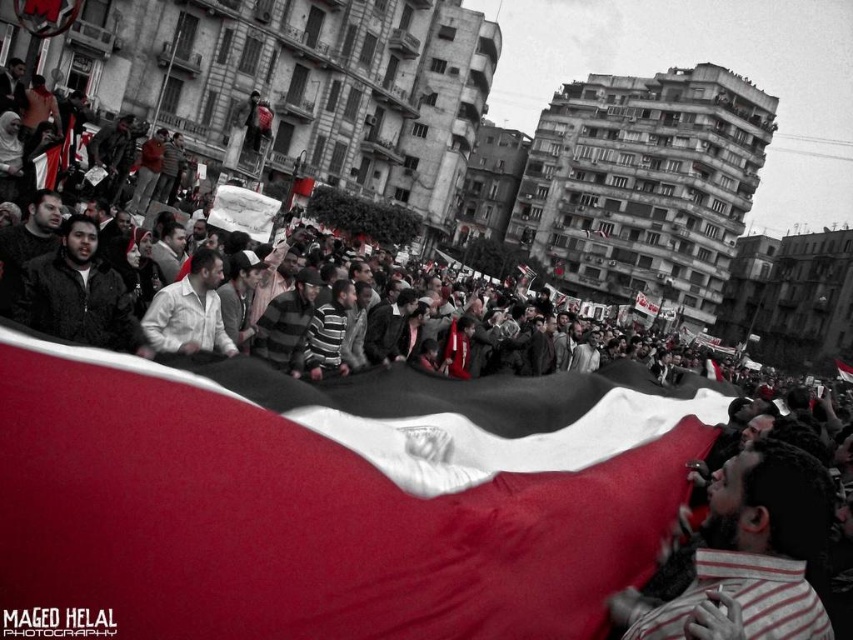
You are a photographer at the protest. You want to take a photo that includes both the striped shirt at lower right and the white matte shirt at center. Given that your camera has a maximum focus range of 100 feet, will you be able to capture both subjects in the same frame?

The striped shirt at lower right and white matte shirt at center are 106.25 feet apart, which exceeds the camera maximum focus range of 100 feet. Therefore, you cannot capture both subjects in the same frame.

You are a photographer standing at the center of the scene. You want to take a photo of the striped shirt at lower right. Which direction should you move to get it in the frame?

The striped shirt at lower right is located at point 0.867 on the x axis and 0.882 on the y axis, so you should move to the right and upwards to center it in the frame.

What is located at the coordinates point (751, 554) in the image?

The striped shirt at lower right is located at point (751, 554).